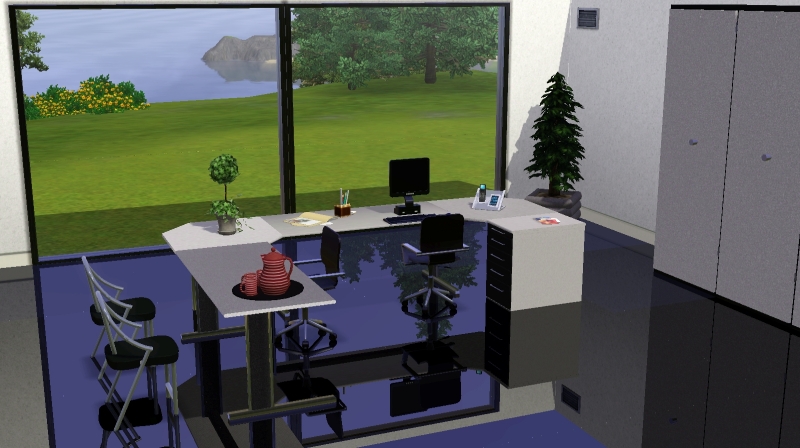
Where is `cabinet`? The height and width of the screenshot is (448, 800). cabinet is located at coordinates (702, 211), (765, 237).